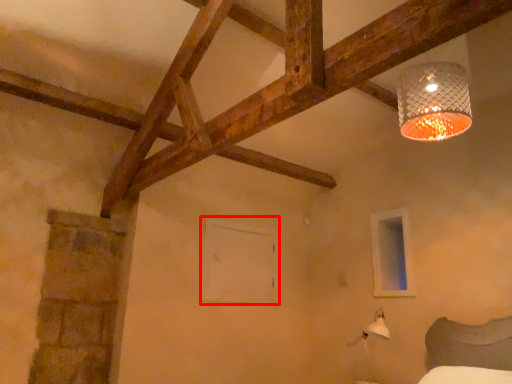
Question: From the image's perspective, considering the relative positions of window frame (annotated by the red box) and window frame in the image provided, where is window frame (annotated by the red box) located with respect to the staircase?

Choices:
 (A) below
 (B) above

Answer: (A)